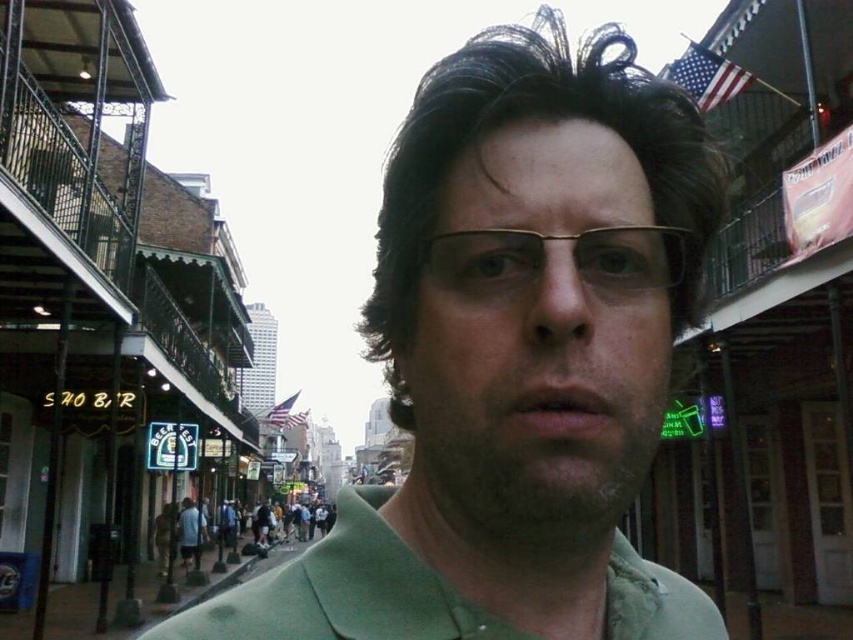
Between dark clothing at center and blue fabric shirt at lower center, which one has more height?

Standing taller between the two is dark clothing at center.

Who is shorter, dark clothing at center or blue fabric shirt at lower center?

blue fabric shirt at lower center is shorter.

Is point (252, 561) in front of point (180, 541)?

No, it is behind (180, 541).

At what (x,y) coordinates should I click in order to perform the action: click on dark clothing at center. Please return your answer as a coordinate pair (x, y). This screenshot has height=640, width=853. Looking at the image, I should click on (260, 560).

Between green cotton shirt at center and gold metallic glasses at center, which one appears on the right side from the viewer's perspective?

gold metallic glasses at center

Does green cotton shirt at center appear on the left side of gold metallic glasses at center?

Yes, green cotton shirt at center is to the left of gold metallic glasses at center.

Is point (625, 614) positioned after point (520, 268)?

Yes.

Where is `green cotton shirt at center`? The image size is (853, 640). green cotton shirt at center is located at coordinates (341, 592).

Between dark brown textured hair at center and green cotton shirt at center, which one has less height?

dark brown textured hair at center is shorter.

Is dark brown textured hair at center shorter than green cotton shirt at center?

Correct, dark brown textured hair at center is not as tall as green cotton shirt at center.

You are a GUI agent. You are given a task and a screenshot of the screen. Output one action in this format:
    pyautogui.click(x=<x>, y=<y>)
    Task: Click on the dark brown textured hair at center
    This screenshot has width=853, height=640.
    Given the screenshot: What is the action you would take?
    pyautogui.click(x=543, y=118)

You are a GUI agent. You are given a task and a screenshot of the screen. Output one action in this format:
    pyautogui.click(x=<x>, y=<y>)
    Task: Click on the dark brown textured hair at center
    Image resolution: width=853 pixels, height=640 pixels.
    Given the screenshot: What is the action you would take?
    coord(543,118)